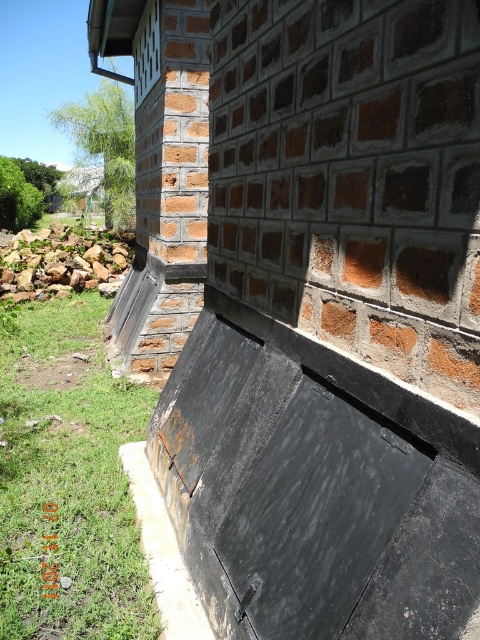
Question: Does green grass at lower left lie in front of brown rough stone at lower left?

Choices:
 (A) yes
 (B) no

Answer: (A)

Question: Does green grass at lower left have a lesser width compared to brown rough stone at lower left?

Choices:
 (A) no
 (B) yes

Answer: (B)

Question: Among these objects, which one is farthest from the camera?

Choices:
 (A) brown rough stone at lower left
 (B) green grass at lower left

Answer: (A)

Question: Which point appears closest to the camera in this image?

Choices:
 (A) (88, 570)
 (B) (75, 289)

Answer: (A)

Question: Among these points, which one is farthest from the camera?

Choices:
 (A) (93, 269)
 (B) (32, 515)

Answer: (A)

Question: Does green grass at lower left have a greater width compared to brown rough stone at lower left?

Choices:
 (A) yes
 (B) no

Answer: (B)